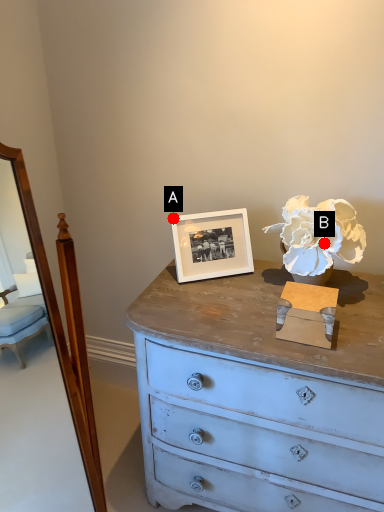
Question: Two points are circled on the image, labeled by A and B beside each circle. Which point appears closest to the camera in this image?

Choices:
 (A) A is closer
 (B) B is closer

Answer: (B)